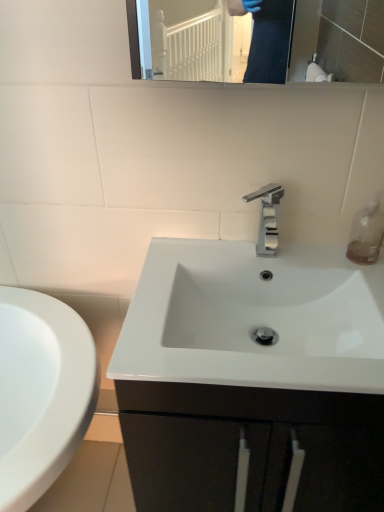
Question: Can you confirm if polished chrome faucet at center is smaller than transparent plastic soap dispenser at upper right?

Choices:
 (A) yes
 (B) no

Answer: (B)

Question: Would you consider polished chrome faucet at center to be distant from transparent plastic soap dispenser at upper right?

Choices:
 (A) no
 (B) yes

Answer: (A)

Question: Is polished chrome faucet at center looking in the opposite direction of transparent plastic soap dispenser at upper right?

Choices:
 (A) no
 (B) yes

Answer: (A)

Question: Considering the relative sizes of polished chrome faucet at center and transparent plastic soap dispenser at upper right in the image provided, is polished chrome faucet at center wider than transparent plastic soap dispenser at upper right?

Choices:
 (A) no
 (B) yes

Answer: (B)

Question: From the image's perspective, is polished chrome faucet at center located beneath transparent plastic soap dispenser at upper right?

Choices:
 (A) no
 (B) yes

Answer: (A)

Question: Considering the relative sizes of polished chrome faucet at center and transparent plastic soap dispenser at upper right in the image provided, is polished chrome faucet at center thinner than transparent plastic soap dispenser at upper right?

Choices:
 (A) yes
 (B) no

Answer: (B)

Question: Does transparent plastic soap dispenser at upper right have a lesser height compared to polished chrome faucet at center?

Choices:
 (A) yes
 (B) no

Answer: (A)

Question: Is transparent plastic soap dispenser at upper right wider than polished chrome faucet at center?

Choices:
 (A) yes
 (B) no

Answer: (B)

Question: From the image's perspective, would you say transparent plastic soap dispenser at upper right is shown under polished chrome faucet at center?

Choices:
 (A) no
 (B) yes

Answer: (B)

Question: Does transparent plastic soap dispenser at upper right appear on the right side of polished chrome faucet at center?

Choices:
 (A) no
 (B) yes

Answer: (B)

Question: Is transparent plastic soap dispenser at upper right positioned behind polished chrome faucet at center?

Choices:
 (A) yes
 (B) no

Answer: (A)

Question: From a real-world perspective, is transparent plastic soap dispenser at upper right positioned under polished chrome faucet at center based on gravity?

Choices:
 (A) no
 (B) yes

Answer: (B)

Question: Is transparent plastic soap dispenser at upper right bigger or smaller than polished chrome faucet at center?

Choices:
 (A) small
 (B) big

Answer: (A)